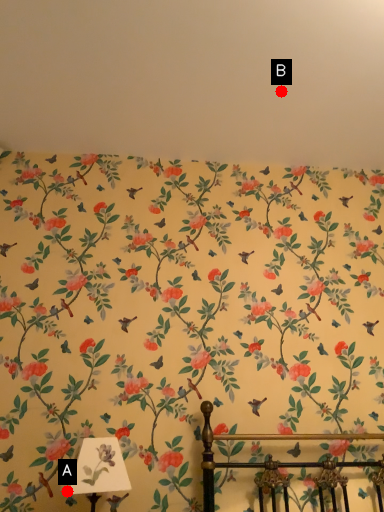
Question: Two points are circled on the image, labeled by A and B beside each circle. Which point appears farthest from the camera in this image?

Choices:
 (A) A is further
 (B) B is further

Answer: (B)